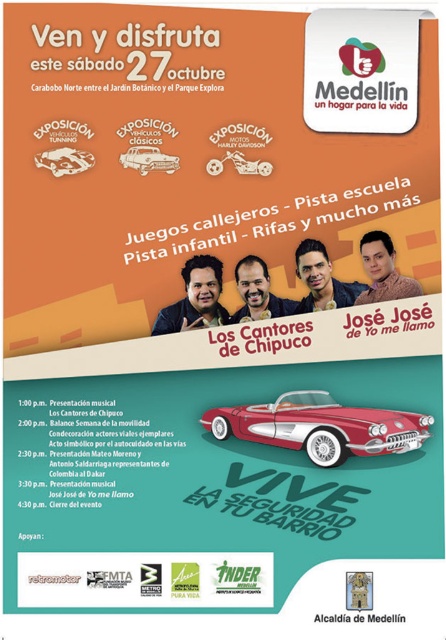
Can you confirm if shiny red convertible at center is thinner than shiny metallic car at upper left?

No, shiny red convertible at center is not thinner than shiny metallic car at upper left.

Can you confirm if shiny red convertible at center is wider than shiny metallic car at upper left?

Correct, the width of shiny red convertible at center exceeds that of shiny metallic car at upper left.

Which is in front, point (273, 429) or point (82, 156)?

Point (82, 156) is in front.

Where is `shiny red convertible at center`? shiny red convertible at center is located at coordinates (321, 426).

Which of these two, shiny red convertible at center or shiny chrome car at center, stands taller?

Standing taller between the two is shiny red convertible at center.

Is shiny red convertible at center further to the viewer compared to shiny chrome car at center?

No, shiny red convertible at center is in front of shiny chrome car at center.

Between point (338, 413) and point (139, 145), which one is positioned behind?

The point (139, 145) is more distant.

Locate an element on the screen. Image resolution: width=446 pixels, height=640 pixels. shiny red convertible at center is located at coordinates (321, 426).

How far apart are shiny metallic car at upper left and shiny chrome car at center?

shiny metallic car at upper left is 6.07 inches from shiny chrome car at center.

Does shiny metallic car at upper left have a lesser width compared to shiny chrome car at center?

Correct, shiny metallic car at upper left's width is less than shiny chrome car at center's.

Which is in front, point (81, 164) or point (156, 150)?

Point (81, 164) is more forward.

Where is `shiny metallic car at upper left`? shiny metallic car at upper left is located at coordinates (65, 161).